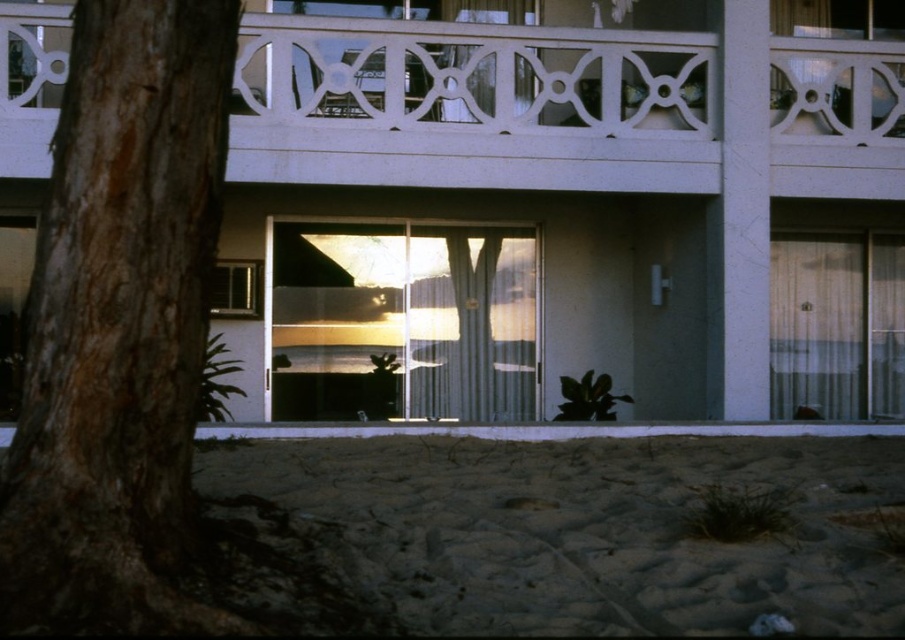
Between point (207, 627) and point (553, 35), which one is positioned behind?

Positioned behind is point (553, 35).

Is brown rough bark tree at left shorter than white textured balcony at upper center?

No, brown rough bark tree at left is not shorter than white textured balcony at upper center.

You are a GUI agent. You are given a task and a screenshot of the screen. Output one action in this format:
    pyautogui.click(x=<x>, y=<y>)
    Task: Click on the brown rough bark tree at left
    The image size is (905, 640).
    Given the screenshot: What is the action you would take?
    pyautogui.click(x=120, y=326)

Where is `brown rough bark tree at left`? The image size is (905, 640). brown rough bark tree at left is located at coordinates click(120, 326).

Does white textured balcony at upper center appear over clear glass window at upper center?

Incorrect, white textured balcony at upper center is not positioned above clear glass window at upper center.

Is white textured balcony at upper center to the right of clear glass window at upper center from the viewer's perspective?

In fact, white textured balcony at upper center is to the left of clear glass window at upper center.

Does point (440, 140) come in front of point (780, 96)?

Yes, point (440, 140) is in front of point (780, 96).

You are a GUI agent. You are given a task and a screenshot of the screen. Output one action in this format:
    pyautogui.click(x=<x>, y=<y>)
    Task: Click on the white textured balcony at upper center
    This screenshot has width=905, height=640.
    Given the screenshot: What is the action you would take?
    pyautogui.click(x=557, y=108)

Which is below, brown sandy beach at lower center or transparent glass door at center?

brown sandy beach at lower center is lower down.

In order to click on brown sandy beach at lower center in this screenshot , I will do `click(583, 529)`.